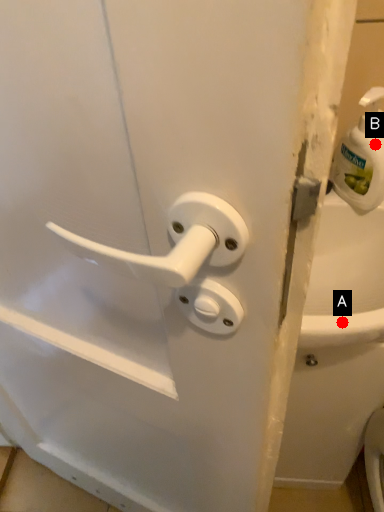
Question: Two points are circled on the image, labeled by A and B beside each circle. Which point is closer to the camera?

Choices:
 (A) A is closer
 (B) B is closer

Answer: (A)